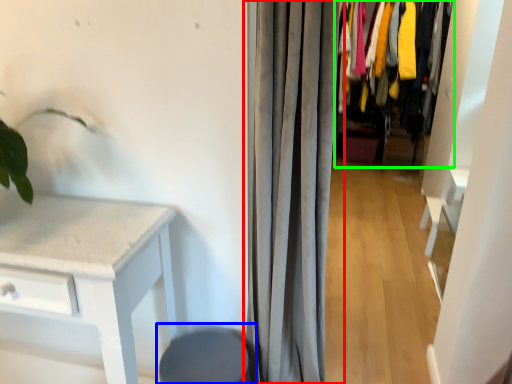
Question: Considering the real-world distances, which object is closest to curtain (highlighted by a red box)? swivel chair (highlighted by a blue box) or closet (highlighted by a green box).

Choices:
 (A) swivel chair
 (B) closet

Answer: (A)